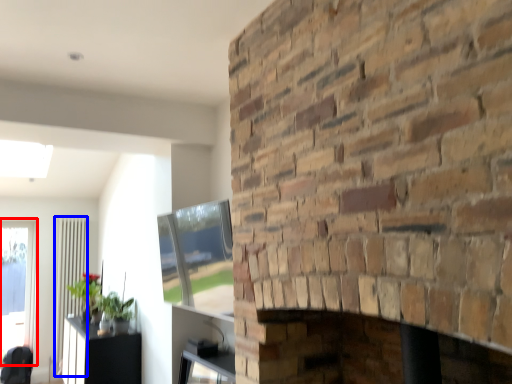
Question: Which object is closer to the camera taking this photo, window (highlighted by a red box) or screen door (highlighted by a blue box)?

Choices:
 (A) window
 (B) screen door

Answer: (A)